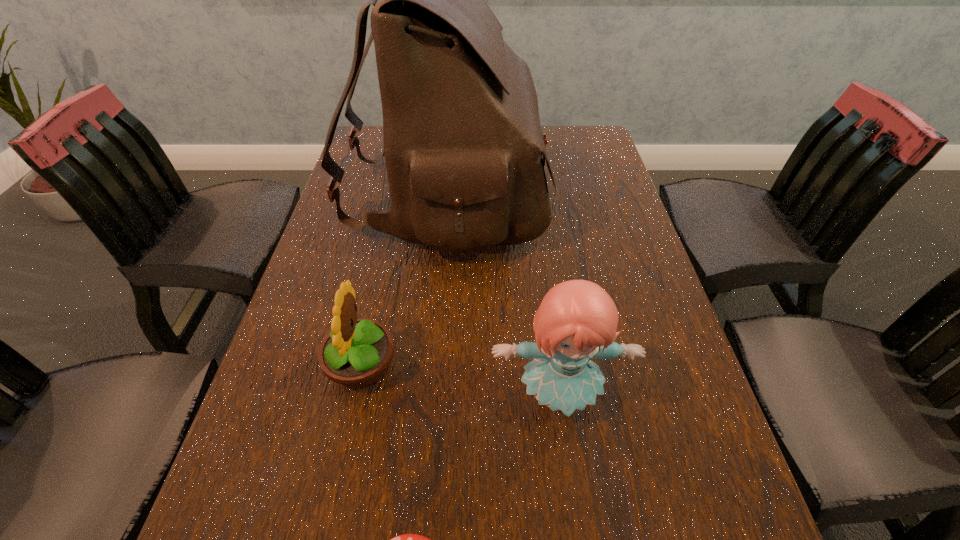
I want to click on object that is at the right edge, so click(x=577, y=320).

The image size is (960, 540). I want to click on object that is at the far left corner, so click(x=463, y=146).

The width and height of the screenshot is (960, 540). I want to click on vacant area at the left edge, so click(x=339, y=274).

In the image, there is a desktop. Where is `free space at the right edge`? free space at the right edge is located at coordinates (628, 225).

Where is `vacant region at the far left corner of the desktop`? Image resolution: width=960 pixels, height=540 pixels. vacant region at the far left corner of the desktop is located at coordinates (375, 133).

This screenshot has width=960, height=540. In the image, there is a desktop. Identify the location of free region at the far right corner. (597, 152).

The height and width of the screenshot is (540, 960). Find the location of `vacant point located between the third shortest object and the sunflower`. vacant point located between the third shortest object and the sunflower is located at coordinates [460, 381].

The width and height of the screenshot is (960, 540). In order to click on vacant region between the sunflower and the second tallest object in this screenshot , I will do `click(460, 381)`.

Image resolution: width=960 pixels, height=540 pixels. In order to click on vacant area that lies between the farthest object and the sunflower in this screenshot , I will do `click(403, 280)`.

At what (x,y) coordinates should I click in order to perform the action: click on empty space that is in between the second tallest object and the satchel. Please return your answer as a coordinate pair (x, y). Looking at the image, I should click on (502, 295).